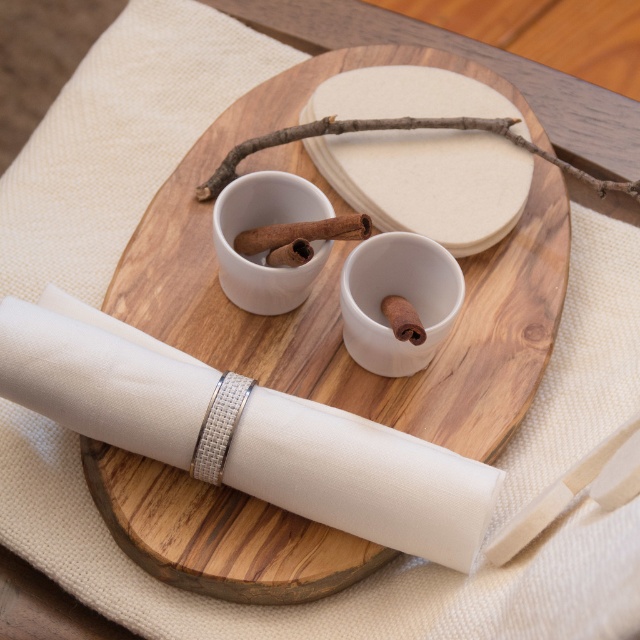
Question: Which point is farther to the camera?

Choices:
 (A) (122, 424)
 (B) (312, 240)
 (C) (520, 145)

Answer: (C)

Question: Is brown rough twig at upper center further to camera compared to brown wood cinnamon stick at center?

Choices:
 (A) no
 (B) yes

Answer: (B)

Question: Which object appears closest to the camera in this image?

Choices:
 (A) brown rough twig at upper center
 (B) wooden tray at center
 (C) white fabric napkin at center

Answer: (C)

Question: Among these objects, which one is nearest to the camera?

Choices:
 (A) white fabric napkin at center
 (B) wooden tray at center

Answer: (A)

Question: Does wooden tray at center come behind white fabric napkin at center?

Choices:
 (A) yes
 (B) no

Answer: (A)

Question: Is brown rough twig at upper center below brown wood cinnamon stick at center?

Choices:
 (A) yes
 (B) no

Answer: (B)